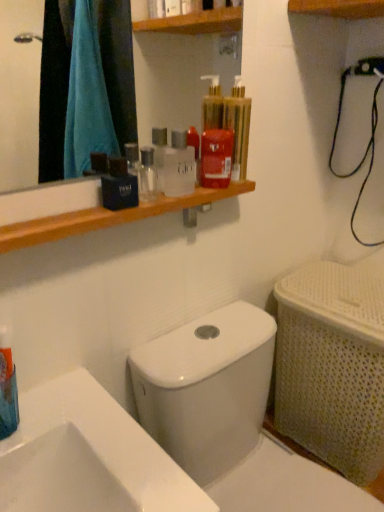
Identify the location of free spot to the right of blue plastic toothbrush at lower left, the fifth mouthwash viewed from the top. Image resolution: width=384 pixels, height=512 pixels. (85, 431).